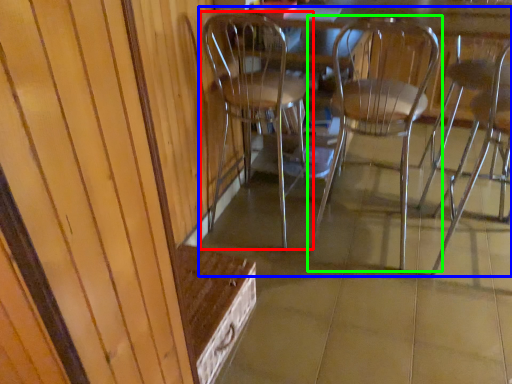
Question: Which object is the farthest from chair (highlighted by a red box)? Choose among these: chair (highlighted by a blue box) or chair (highlighted by a green box).

Choices:
 (A) chair
 (B) chair

Answer: (B)